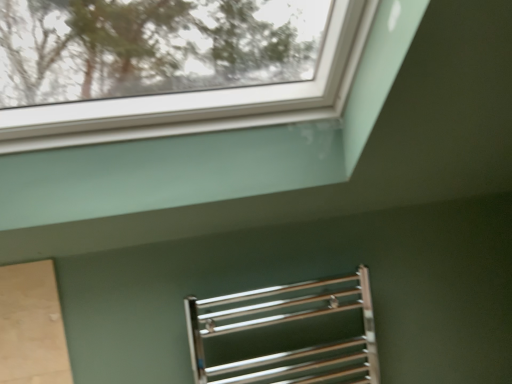
Describe the element at coordinates (286, 334) in the screenshot. I see `polished metal towel rack at lower center` at that location.

At what (x,y) coordinates should I click in order to perform the action: click on polished metal towel rack at lower center. Please return your answer as a coordinate pair (x, y). The width and height of the screenshot is (512, 384). Looking at the image, I should click on (286, 334).

Identify the location of polished metal towel rack at lower center. Image resolution: width=512 pixels, height=384 pixels. (286, 334).